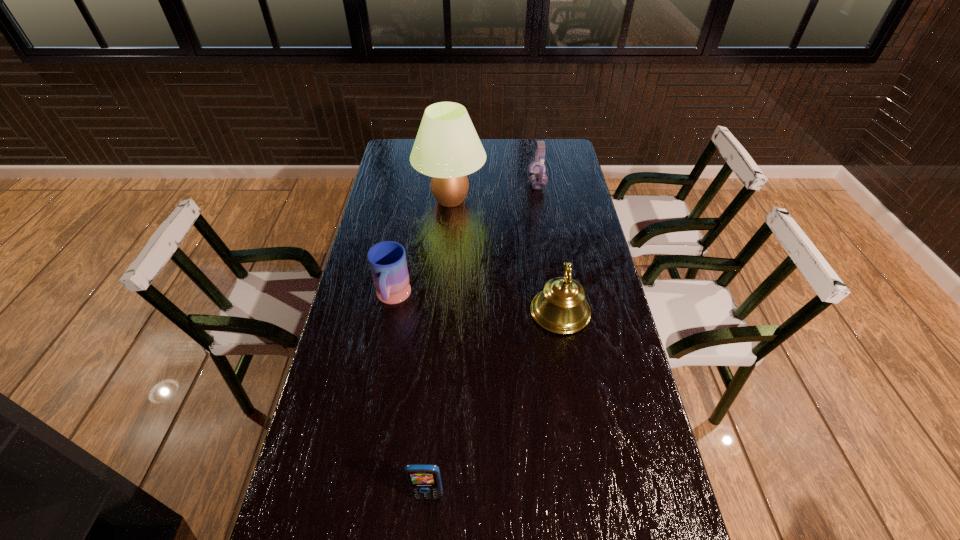
Locate an element on the screen. The height and width of the screenshot is (540, 960). free point located 0.080m on the side of the mug with the handle is located at coordinates (x=385, y=340).

The width and height of the screenshot is (960, 540). In order to click on object located in the left edge section of the desktop in this screenshot , I will do `click(387, 260)`.

Identify the location of bell located in the right edge section of the desktop. Image resolution: width=960 pixels, height=540 pixels. (561, 308).

Where is `headset located at the right edge`? headset located at the right edge is located at coordinates (538, 179).

Where is `vacant region at the left edge of the desktop`? Image resolution: width=960 pixels, height=540 pixels. vacant region at the left edge of the desktop is located at coordinates (408, 171).

The height and width of the screenshot is (540, 960). What are the coordinates of `vacant region between the cellular telephone and the bell` in the screenshot? It's located at (493, 403).

Find the location of a particular element. The width and height of the screenshot is (960, 540). free spot between the tallest object and the bell is located at coordinates (505, 256).

At what (x,y) coordinates should I click in order to perform the action: click on free space between the mug and the headset. Please return your answer as a coordinate pair (x, y). The width and height of the screenshot is (960, 540). Looking at the image, I should click on (465, 240).

At what (x,y) coordinates should I click in order to perform the action: click on free space between the lampshade and the mug. Please return your answer as a coordinate pair (x, y). Looking at the image, I should click on (421, 249).

You are a GUI agent. You are given a task and a screenshot of the screen. Output one action in this format:
    pyautogui.click(x=<x>, y=<y>)
    Task: Click on the free area in between the cellular telephone and the bell
    The width and height of the screenshot is (960, 540).
    Given the screenshot: What is the action you would take?
    pyautogui.click(x=493, y=403)